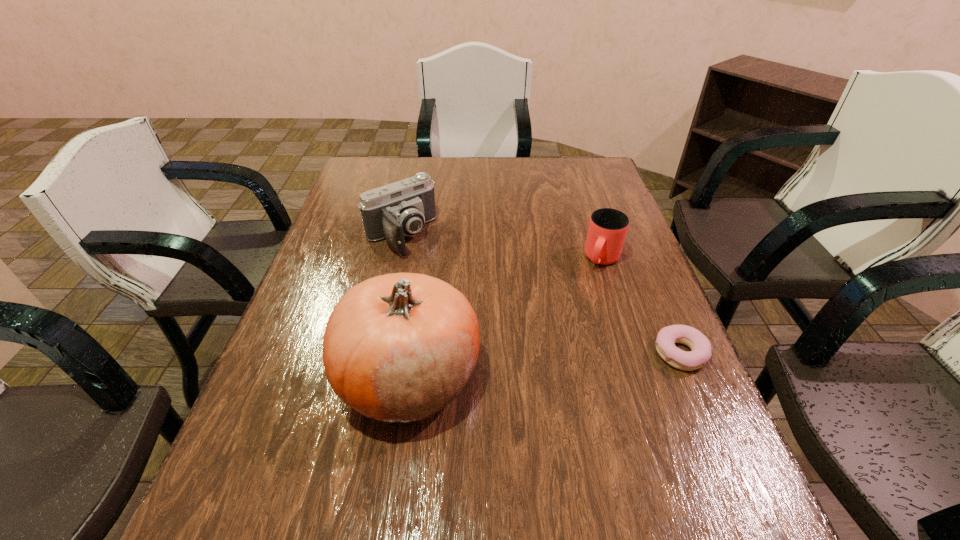
Find the location of a particular element. This screenshot has height=540, width=960. free space between the second tallest object and the shortest object is located at coordinates (540, 294).

This screenshot has width=960, height=540. I want to click on free space between the doughnut and the tallest object, so click(544, 365).

In order to click on empty space that is in between the cup and the camera in this screenshot , I will do `click(501, 247)`.

Locate which object is the third closest to the cup. Please provide its 2D coordinates. Your answer should be formatted as a tuple, i.e. [(x, y)], where the tuple contains the x and y coordinates of a point satisfying the conditions above.

[(401, 208)]

Choose which object is the nearest neighbor to the shortest object. Please provide its 2D coordinates. Your answer should be formatted as a tuple, i.e. [(x, y)], where the tuple contains the x and y coordinates of a point satisfying the conditions above.

[(607, 230)]

Locate an element on the screen. The image size is (960, 540). vacant position in the image that satisfies the following two spatial constraints: 1. on the back side of the pumpkin; 2. on the left side of the shortest object is located at coordinates point(413,353).